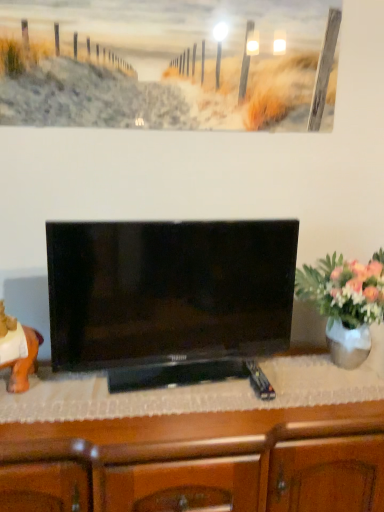
Describe the element at coordinates (18, 350) in the screenshot. I see `orange matte statue at left` at that location.

Locate an element on the screen. This screenshot has width=384, height=512. orange matte statue at left is located at coordinates (18, 350).

This screenshot has width=384, height=512. There is a wooden cabinet at center. What are the coordinates of `television above it (from a real-world perspective)` in the screenshot? It's located at (x=170, y=300).

Considering the relative sizes of black glossy tv at center and wooden cabinet at center in the image provided, is black glossy tv at center bigger than wooden cabinet at center?

Incorrect, black glossy tv at center is not larger than wooden cabinet at center.

From the image's perspective, is black glossy tv at center located beneath wooden cabinet at center?

No, from the image's perspective, black glossy tv at center is not below wooden cabinet at center.

Is point (35, 342) closer or farther from the camera than point (197, 442)?

Point (35, 342) is positioned farther from the camera compared to point (197, 442).

Would you say orange matte statue at left is outside wooden cabinet at center?

That's correct, orange matte statue at left is outside of wooden cabinet at center.

Considering the relative sizes of orange matte statue at left and wooden cabinet at center in the image provided, is orange matte statue at left thinner than wooden cabinet at center?

Yes.

Does black glossy tv at center have a greater height compared to white glossy vase at right?

Indeed, black glossy tv at center has a greater height compared to white glossy vase at right.

Is black glossy tv at center behind white glossy vase at right?

That is False.

From a real-world perspective, is black glossy tv at center physically located above or below white glossy vase at right?

black glossy tv at center is situated higher than white glossy vase at right in the real world.

Between black glossy tv at center and white glossy vase at right, which one has smaller width?

black glossy tv at center.

Which point is more distant from viewer, (343,282) or (69,366)?

Positioned behind is point (343,282).

From the image's perspective, is white glossy vase at right below black glossy tv at center?

Indeed, from the image's perspective, white glossy vase at right is shown beneath black glossy tv at center.

Which of these two, white glossy vase at right or black glossy tv at center, stands taller?

Standing taller between the two is black glossy tv at center.

From a real-world perspective, which object rests below the other?

From a 3D spatial view, white glossy vase at right is below.

Does orange matte statue at left have a greater width compared to black glossy tv at center?

Incorrect, the width of orange matte statue at left does not surpass that of black glossy tv at center.

Find the location of a particular element. Image resolution: width=384 pixels, height=512 pixels. animal located underneath the black glossy tv at center (from a real-world perspective) is located at coordinates (18, 350).

Does orange matte statue at left contain black glossy tv at center?

No, black glossy tv at center is located outside of orange matte statue at left.

Considering the relative sizes of orange matte statue at left and black glossy tv at center in the image provided, is orange matte statue at left bigger than black glossy tv at center?

Actually, orange matte statue at left might be smaller than black glossy tv at center.

Which object is more forward, wooden cabinet at center or white glossy vase at right?

wooden cabinet at center is closer to the camera.

Is wooden cabinet at center at the right side of white glossy vase at right?

No, wooden cabinet at center is not to the right of white glossy vase at right.

Between wooden cabinet at center and white glossy vase at right, which one has smaller width?

With smaller width is white glossy vase at right.

How far apart are wooden cabinet at center and white glossy vase at right?

A distance of 43.36 centimeters exists between wooden cabinet at center and white glossy vase at right.

Is white glossy vase at right bigger or smaller than wooden cabinet at center?

white glossy vase at right is smaller than wooden cabinet at center.

Is point (344, 297) more distant than point (197, 444)?

Yes.

Considering the positions of objects white glossy vase at right and wooden cabinet at center in the image provided, who is more to the left, white glossy vase at right or wooden cabinet at center?

Positioned to the left is wooden cabinet at center.

From a real-world perspective, who is located higher, white glossy vase at right or wooden cabinet at center?

white glossy vase at right.

You are a GUI agent. You are given a task and a screenshot of the screen. Output one action in this format:
    pyautogui.click(x=<x>, y=<y>)
    Task: Click on the cabinetry below the black glossy tv at center (from a real-world perspective)
    Image resolution: width=384 pixels, height=512 pixels.
    Given the screenshot: What is the action you would take?
    pyautogui.click(x=199, y=462)

Where is `animal lying behind the wooden cabinet at center`? animal lying behind the wooden cabinet at center is located at coordinates (18, 350).

Which object lies nearer to the anchor point orange matte statue at left, white glossy vase at right or black glossy tv at center?

black glossy tv at center is closer to orange matte statue at left.

From the image, which object appears to be farther from black glossy tv at center, wooden cabinet at center or orange matte statue at left?

Among the two, orange matte statue at left is located further to black glossy tv at center.

Based on their spatial positions, is wooden cabinet at center or black glossy tv at center further from orange matte statue at left?

Based on the image, wooden cabinet at center appears to be further to orange matte statue at left.

From the picture: Considering their positions, is wooden cabinet at center positioned further to white glossy vase at right than black glossy tv at center?

wooden cabinet at center lies further to white glossy vase at right than the other object.

Considering their positions, is white glossy vase at right positioned closer to orange matte statue at left than wooden cabinet at center?

Based on the image, wooden cabinet at center appears to be nearer to orange matte statue at left.

Based on the photo, estimate the real-world distances between objects in this image. Which object is closer to white glossy vase at right, black glossy tv at center or orange matte statue at left?

black glossy tv at center is positioned closer to the anchor white glossy vase at right.

Which object lies nearer to the anchor point wooden cabinet at center, black glossy tv at center or white glossy vase at right?

Among the two, black glossy tv at center is located nearer to wooden cabinet at center.

From the image, which object appears to be farther from wooden cabinet at center, black glossy tv at center or orange matte statue at left?

orange matte statue at left is further to wooden cabinet at center.

Where is `cabinetry situated between orange matte statue at left and white glossy vase at right from left to right`? The height and width of the screenshot is (512, 384). cabinetry situated between orange matte statue at left and white glossy vase at right from left to right is located at coordinates (199, 462).

Identify the location of animal between black glossy tv at center and wooden cabinet at center vertically. (18, 350).

This screenshot has width=384, height=512. In order to click on television between orange matte statue at left and white glossy vase at right from left to right in this screenshot , I will do `click(170, 300)`.

Identify the location of houseplant between black glossy tv at center and wooden cabinet at center from top to bottom. This screenshot has width=384, height=512. (345, 303).